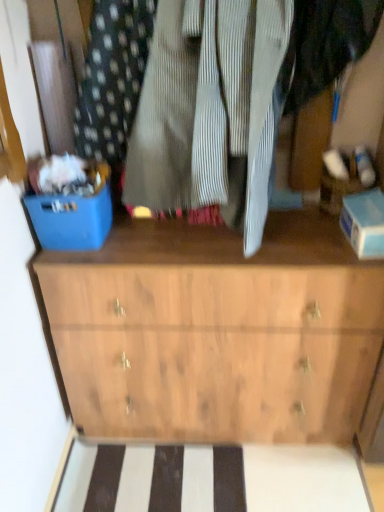
At what (x,y) coordinates should I click in order to perform the action: click on vacant area that is situated to the right of blue plastic bin at left. Please return your answer as a coordinate pair (x, y). The height and width of the screenshot is (512, 384). Looking at the image, I should click on (167, 238).